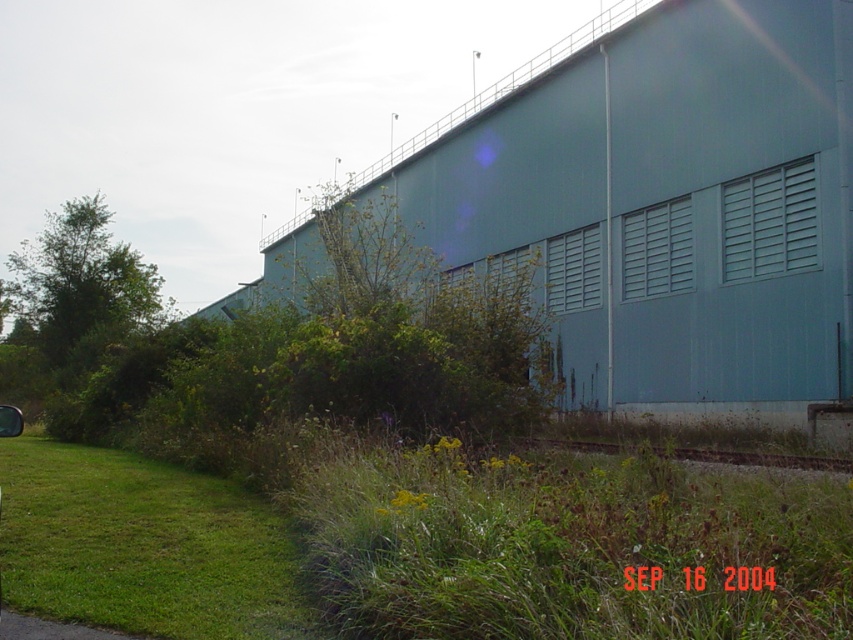
You are standing at the entrance of the industrial building and see the green grassy at lower left and the metallic silver car at lower left. Which object is closer to you?

The green grassy at lower left is closer to you because the metallic silver car at lower left is behind it.

Based on the photo, you are a pedestrian standing on the paved path in the foreground. You see the gray gravel train track at lower center and the metallic silver car at lower left. Which object is closer to you?

The gray gravel train track at lower center is closer to you because the metallic silver car at lower left is behind it.

You are standing at the entrance of the industrial building and want to walk to the paved path that leads to the parking lot. You see the green grassy at lower left and the gray gravel train track at lower center. Which path should you avoid to prevent walking on vegetation?

You should avoid the green grassy at lower left because it is positioned over the gray gravel train track at lower center, meaning the gray gravel train track at lower center is the paved path leading to the parking lot, while the green grassy area is the vegetation to avoid.